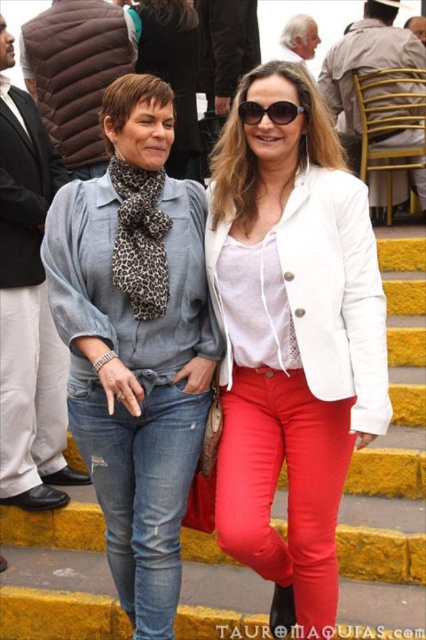
You are a photographer setting up a shoot. You need to position two pairs of jeans in the frame so that they are visible but not overlapping. The denim jeans at left and the ripped denim jeans at center are part of the setup. Which pair should you place farther back to ensure both are fully visible?

The denim jeans at left is bigger than the ripped denim jeans at center, so to ensure both are fully visible without overlapping, place the larger denim jeans at left farther back since it takes up more space.

You are a photographer trying to capture a photo of the two women. Since the yellow painted stairs at center are blocking the view of the denim jeans at left, how can you adjust your position to ensure both subjects are fully visible?

Move forward so that the yellow painted stairs at center are no longer blocking the denim jeans at left.

You are a photographer trying to focus on the clothing items in the image. Which clothing item, the white leather jacket at center or the ripped denim jeans at center, is positioned higher on the body?

The white leather jacket at center is positioned higher on the body than the ripped denim jeans at center because it is above the jeans.